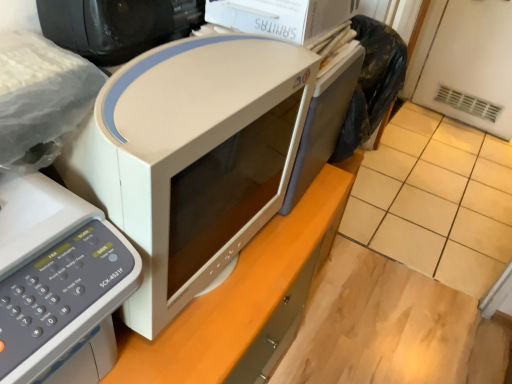
I want to click on vacant area located to the right-hand side of white matte microwave at center, which is counted as the second home appliance, starting from the left, so click(283, 254).